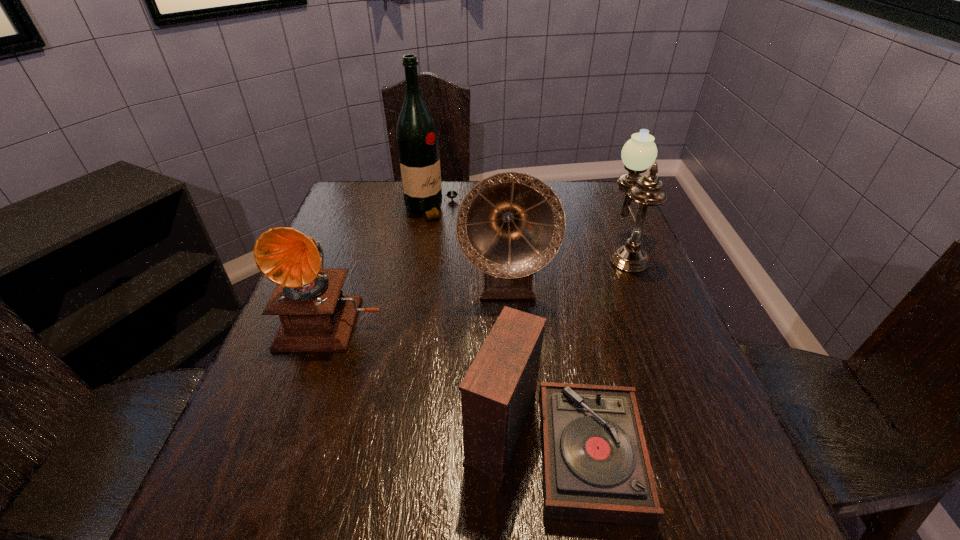
The height and width of the screenshot is (540, 960). What are the coordinates of `object present at the far edge` in the screenshot? It's located at [x=417, y=140].

The height and width of the screenshot is (540, 960). Identify the location of object present at the near edge. (595, 463).

Identify the location of object at the left edge. The image size is (960, 540). coord(315,316).

This screenshot has width=960, height=540. I want to click on oil lamp present at the right edge, so click(639, 153).

This screenshot has width=960, height=540. What are the coordinates of `phonograph record that is positioned at the right edge` in the screenshot? It's located at (595, 463).

This screenshot has height=540, width=960. Find the location of `object positioned at the near right corner`. object positioned at the near right corner is located at coordinates (595, 463).

In the image, there is a desktop. Where is `vacant area at the near edge`? This screenshot has height=540, width=960. vacant area at the near edge is located at coordinates (607, 538).

I want to click on vacant area at the left edge of the desktop, so click(x=260, y=375).

This screenshot has width=960, height=540. I want to click on free spot at the right edge of the desktop, so click(615, 285).

Find the location of a particular element. vacant space at the far left corner is located at coordinates (389, 187).